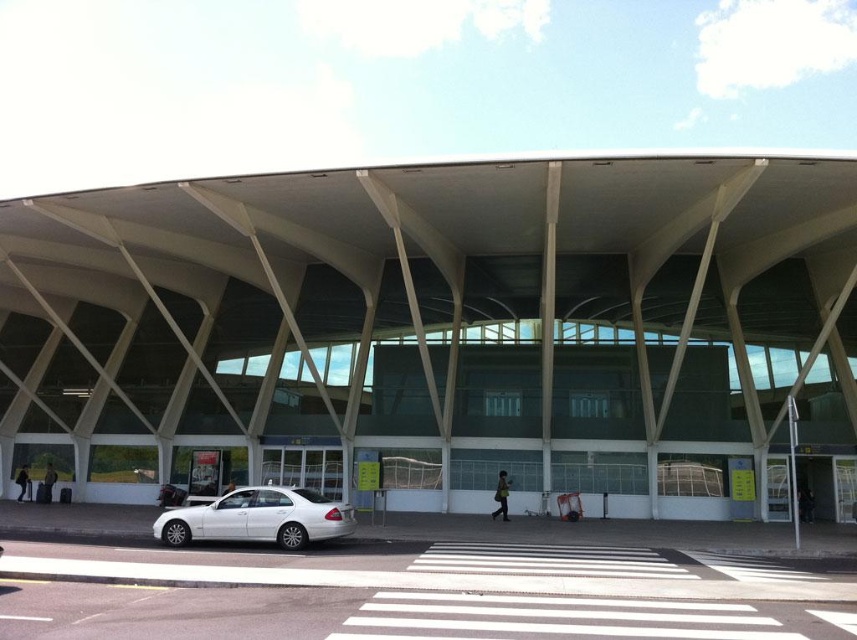
You are a photographer standing in front of the matte white building at center and the white glossy sedan at center. You want to take a photo of the sedan without the building blocking it. Is there a way to adjust your position so that the sedan is visible without the building in the frame?

The matte white building at center is positioned over the white glossy sedan at center, so moving to a lower angle or position where the building is not directly above might allow the sedan to be visible without obstruction.

Consider the image. You are a photographer planning to capture the matte white building at center and the white glossy sedan at center from a distance. Based on their sizes, which object should appear larger in your photo?

The matte white building at center appears larger in the photo because its width is greater than that of the white glossy sedan at center.